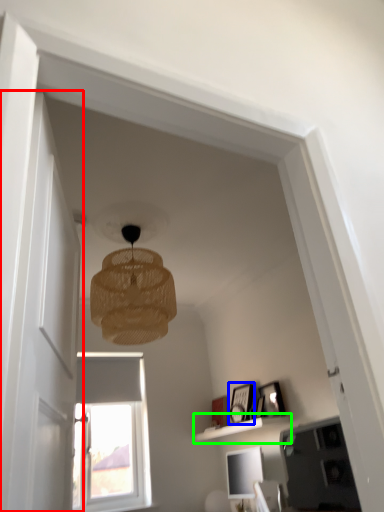
Question: Which object is positioned closest to glass door (highlighted by a red box)? Select from picture frame (highlighted by a blue box) and shelf (highlighted by a green box).

Choices:
 (A) picture frame
 (B) shelf

Answer: (B)